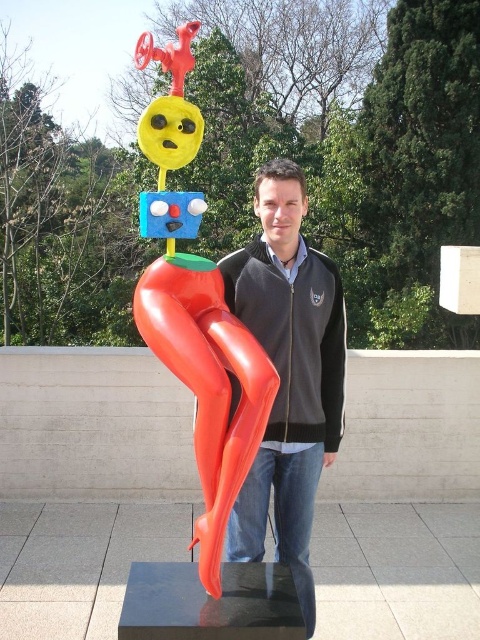
Does matte black jacket at center lie in front of rubber-like orange legs at center?

No, it is not.

Which is in front, point (264, 493) or point (252, 353)?

Point (252, 353)

Which is in front, point (320, 372) or point (204, 465)?

Positioned in front is point (204, 465).

This screenshot has width=480, height=640. Identify the location of matte black jacket at center. (288, 372).